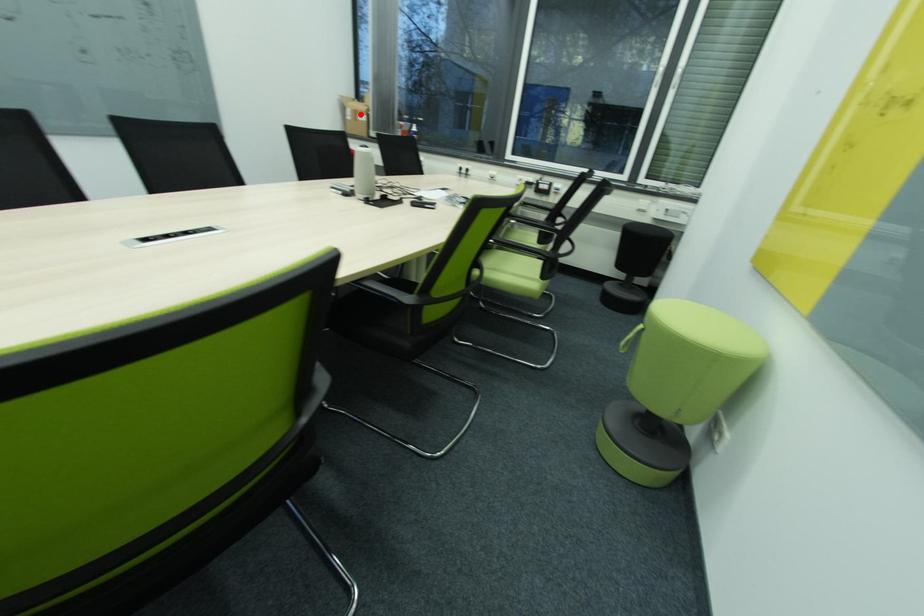
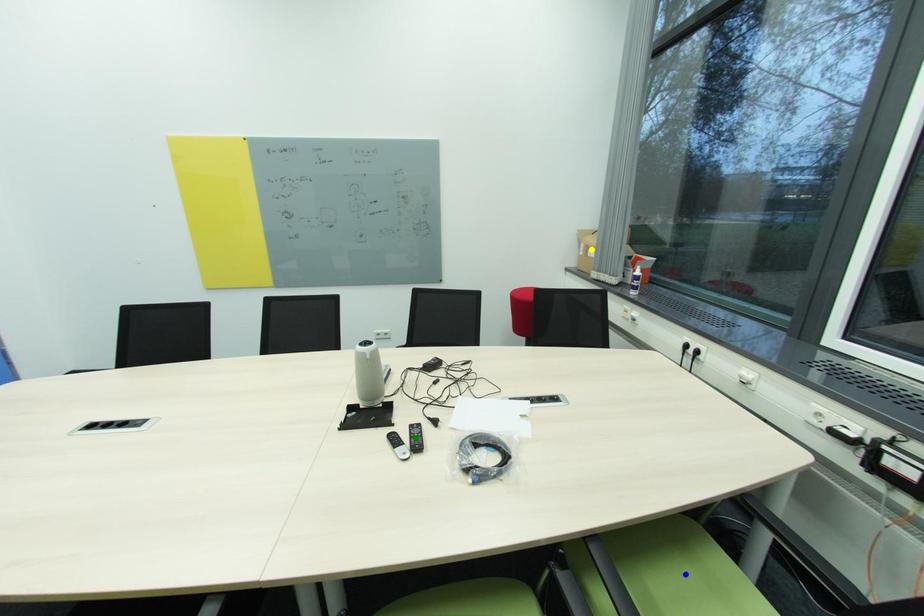
Question: I am providing you with two images of the same scene from different viewpoints. A red point is marked on the first image. You are given multiple points on the second image. In image 2, which mark is for the same physical point as the one in image 1?

Choices:
 (A) yellow point
 (B) green point
 (C) blue point

Answer: (A)